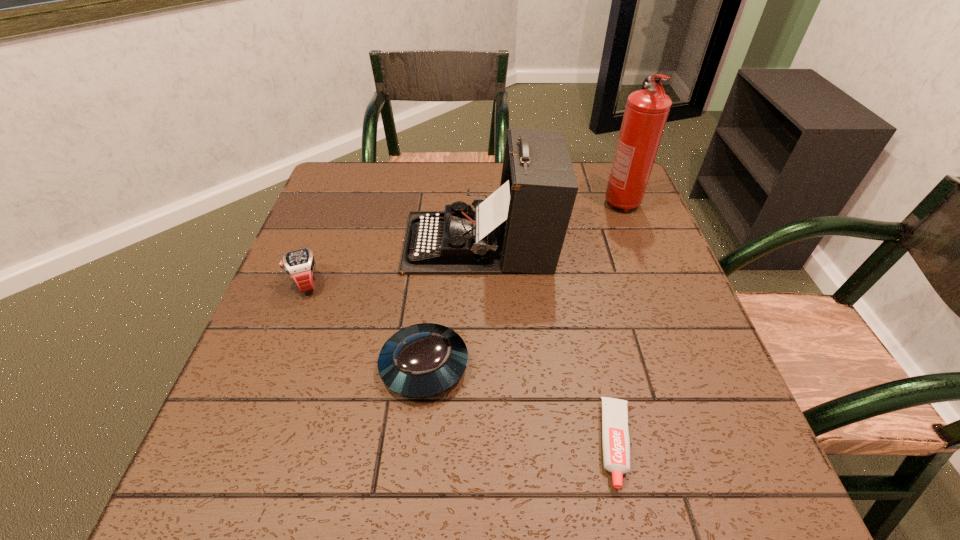
Where is `free space between the typewriter and the third tallest object`? Image resolution: width=960 pixels, height=540 pixels. free space between the typewriter and the third tallest object is located at coordinates (394, 262).

Where is `object that stands as the second closest to the second shortest object`? The width and height of the screenshot is (960, 540). object that stands as the second closest to the second shortest object is located at coordinates point(299,264).

Select which object appears as the second closest to the toothpaste. Please provide its 2D coordinates. Your answer should be formatted as a tuple, i.e. [(x, y)], where the tuple contains the x and y coordinates of a point satisfying the conditions above.

[(521, 227)]

Identify the location of free space that satisfies the following two spatial constraints: 1. inside the open case of the typewriter; 2. on the front side of the third tallest object. (480, 282).

This screenshot has width=960, height=540. In order to click on free spot that satisfies the following two spatial constraints: 1. inside the open case of the fourth shortest object; 2. on the front side of the second shortest object in this screenshot , I will do `click(480, 366)`.

Locate an element on the screen. vacant region that satisfies the following two spatial constraints: 1. inside the open case of the second tallest object; 2. on the front side of the fourth tallest object is located at coordinates (480, 366).